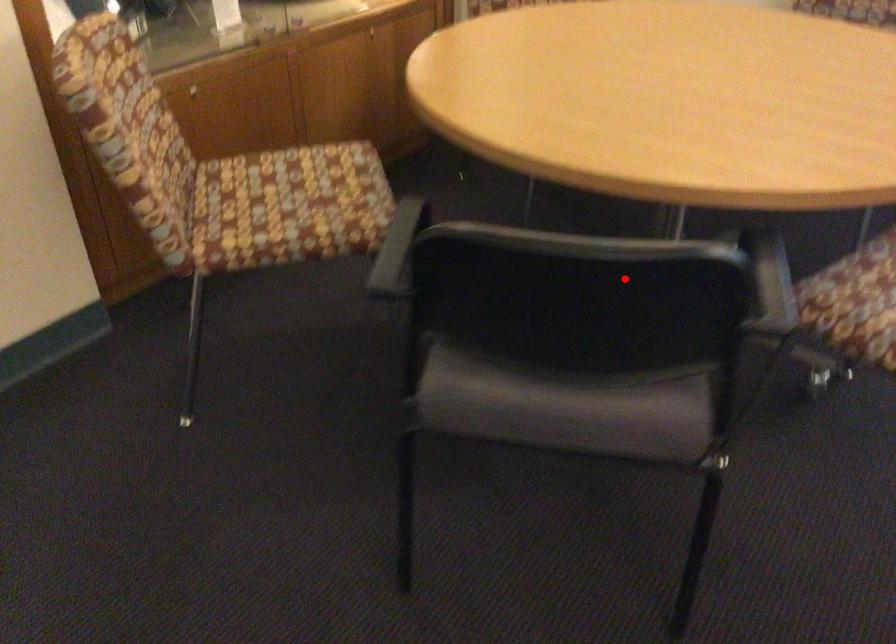
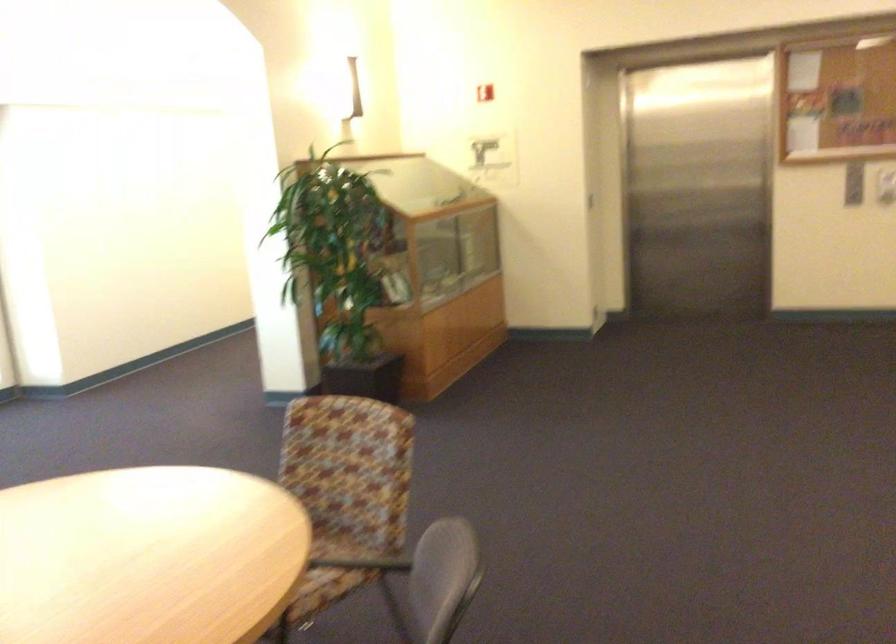
Where in the second image is the point corresponding to the highlighted location from the first image?

(435, 583)